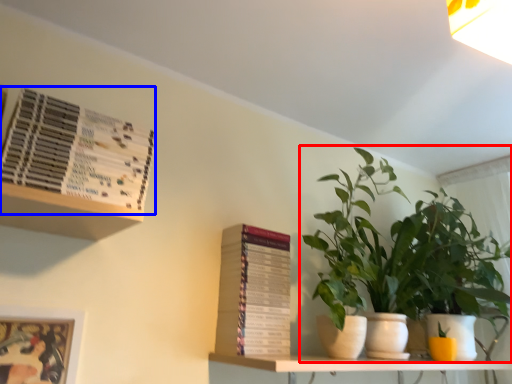
Question: Which point is further to the camera, houseplant (highlighted by a red box) or paperback book (highlighted by a blue box)?

Choices:
 (A) houseplant
 (B) paperback book

Answer: (A)